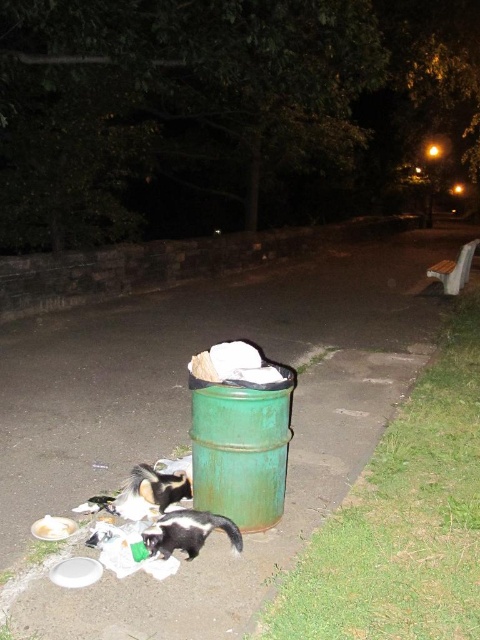
Question: Does green metallic trash can at lower center have a smaller size compared to black and white fur cat at lower center?

Choices:
 (A) no
 (B) yes

Answer: (A)

Question: Is green metallic trash can at lower center wider than black and white fur cat at lower center?

Choices:
 (A) no
 (B) yes

Answer: (B)

Question: Is green metallic trash can at lower center bigger than black and white fur cat at lower center?

Choices:
 (A) no
 (B) yes

Answer: (B)

Question: Among these points, which one is farthest from the camera?

Choices:
 (A) (228, 522)
 (B) (420, 348)

Answer: (B)

Question: Among these points, which one is nearest to the camera?

Choices:
 (A) (180, 529)
 (B) (223, 564)

Answer: (B)